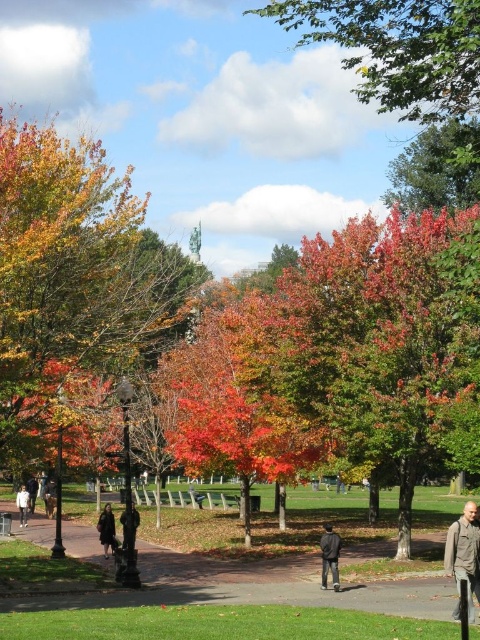
You are standing in the park and want to walk towards the two points marked in the image. Which point, point (x=116, y=547) or point (x=123, y=513), is closer to you?

Point (x=116, y=547) is closer to you because it is further to the camera than point (x=123, y=513).